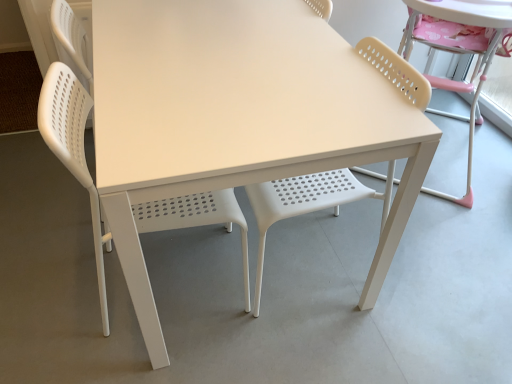
Question: Can you confirm if white plastic table at center is bigger than beige perforated chair at right, placed as the 3th chair when sorted from left to right?

Choices:
 (A) yes
 (B) no

Answer: (B)

Question: From the image's perspective, would you say white plastic table at center is shown under beige perforated chair at right, placed as the 3th chair when sorted from left to right?

Choices:
 (A) yes
 (B) no

Answer: (A)

Question: Is white plastic table at center oriented away from beige perforated chair at right, placed as the 3th chair when sorted from left to right?

Choices:
 (A) yes
 (B) no

Answer: (B)

Question: Is beige perforated chair at right, the first chair viewed from the right, surrounded by white plastic table at center?

Choices:
 (A) yes
 (B) no

Answer: (B)

Question: Considering the relative sizes of white plastic table at center and beige perforated chair at right, placed as the 3th chair when sorted from left to right, in the image provided, is white plastic table at center wider than beige perforated chair at right, placed as the 3th chair when sorted from left to right,?

Choices:
 (A) yes
 (B) no

Answer: (A)

Question: Is white plastic table at center taller than beige perforated chair at right, placed as the 3th chair when sorted from left to right?

Choices:
 (A) no
 (B) yes

Answer: (A)

Question: Is white plastic chair at left, arranged as the 3th chair when viewed from the right, behind matte white chair at center, placed as the second chair when sorted from right to left?

Choices:
 (A) no
 (B) yes

Answer: (A)

Question: Is white plastic chair at left, arranged as the 3th chair when viewed from the right, bigger than matte white chair at center, placed as the second chair when sorted from right to left?

Choices:
 (A) no
 (B) yes

Answer: (B)

Question: Is white plastic chair at left, arranged as the 3th chair when viewed from the right, to the left of matte white chair at center, which ranks as the 2th chair in left-to-right order, from the viewer's perspective?

Choices:
 (A) no
 (B) yes

Answer: (B)

Question: From the image's perspective, is white plastic chair at left, which ranks as the 1th chair in left-to-right order, on matte white chair at center, placed as the second chair when sorted from right to left?

Choices:
 (A) yes
 (B) no

Answer: (B)

Question: Considering the relative sizes of white plastic chair at left, arranged as the 3th chair when viewed from the right, and matte white chair at center, placed as the second chair when sorted from right to left, in the image provided, is white plastic chair at left, arranged as the 3th chair when viewed from the right, shorter than matte white chair at center, placed as the second chair when sorted from right to left,?

Choices:
 (A) yes
 (B) no

Answer: (B)

Question: Is the position of white plastic chair at left, which ranks as the 1th chair in left-to-right order, less distant than that of matte white chair at center, placed as the second chair when sorted from right to left?

Choices:
 (A) no
 (B) yes

Answer: (B)

Question: From the image's perspective, is white plastic chair at left, arranged as the 3th chair when viewed from the right, located beneath beige perforated chair at right, the first chair viewed from the right?

Choices:
 (A) yes
 (B) no

Answer: (A)